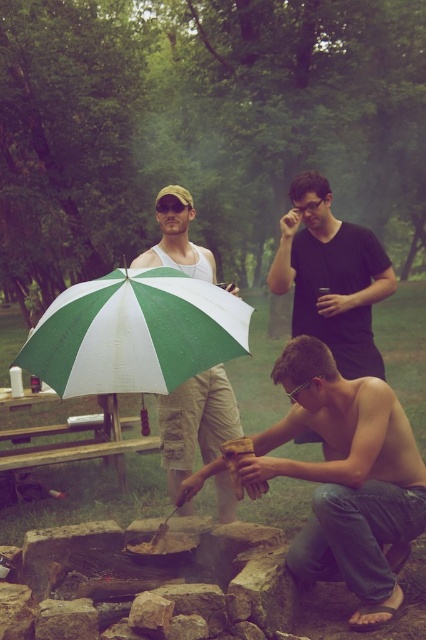
You are a photographer aiming to capture the wooden log at center and the black matte shirt at upper center in the same frame. Based on their positions, which object should you adjust your camera to focus on first to ensure both are in the frame?

The wooden log at center is to the left of black matte shirt at upper center, so you should focus on the black matte shirt at upper center first to ensure both are in the frame.

You are standing in the forest scene and want to reach the green and white umbrella at center without stepping on the black matte shirt at upper center. Which object should you avoid stepping over first?

You should avoid stepping over the black matte shirt at upper center first because it is closer to you than the green and white umbrella at center.